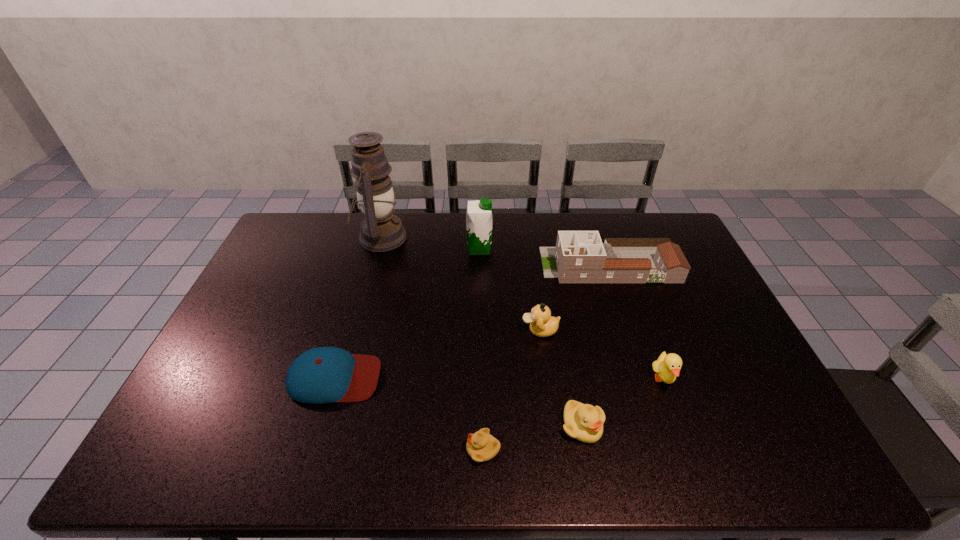
The image size is (960, 540). Find the location of `vacant space located 0.280m on the front-facing side of the leftmost duckling`. vacant space located 0.280m on the front-facing side of the leftmost duckling is located at coordinates (348, 449).

Locate an element on the screen. The height and width of the screenshot is (540, 960). vacant space situated 0.210m on the front-facing side of the leftmost duckling is located at coordinates (377, 449).

Where is `oil lamp positioned at the far edge`? The height and width of the screenshot is (540, 960). oil lamp positioned at the far edge is located at coordinates (381, 230).

Where is `soya milk present at the far edge`? Image resolution: width=960 pixels, height=540 pixels. soya milk present at the far edge is located at coordinates (479, 221).

Identify the location of dollhouse located at the far edge. This screenshot has height=540, width=960. (579, 256).

Find the location of a particular element. object located in the right edge section of the desktop is located at coordinates (579, 256).

Identify the location of object that is at the far right corner. (579, 256).

Where is `free space at the far edge of the desktop`? The image size is (960, 540). free space at the far edge of the desktop is located at coordinates (353, 212).

Where is `vacant area at the near edge of the desktop`? This screenshot has width=960, height=540. vacant area at the near edge of the desktop is located at coordinates (382, 463).

The width and height of the screenshot is (960, 540). I want to click on free spot at the left edge of the desktop, so click(233, 318).